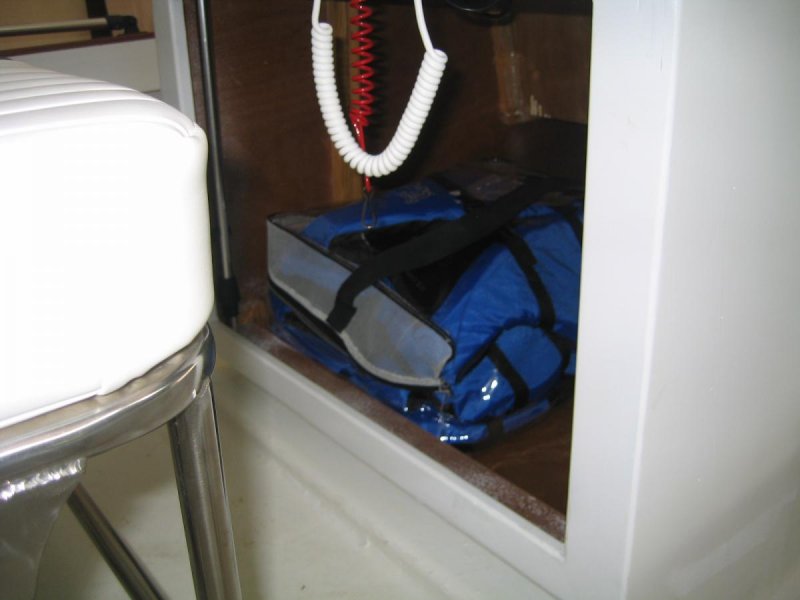
At what (x,y) coordinates should I click in order to perform the action: click on leather cushion. Please return your answer as a coordinate pair (x, y). Looking at the image, I should click on (122, 216).